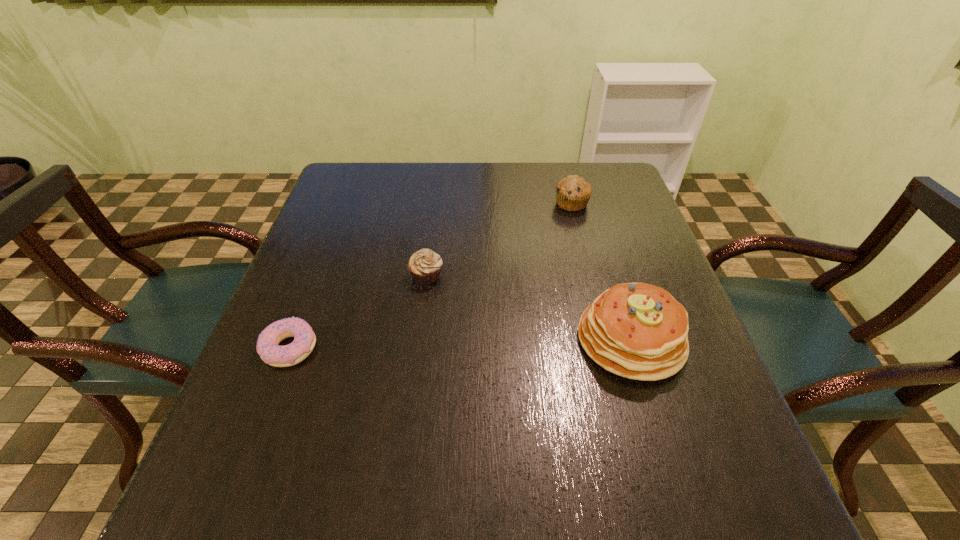
Locate which object is the third closest to the second tallest object. Please provide its 2D coordinates. Your answer should be formatted as a tuple, i.e. [(x, y)], where the tuple contains the x and y coordinates of a point satisfying the conditions above.

[(268, 347)]

This screenshot has height=540, width=960. I want to click on object that is the third closest to the nearer muffin, so click(573, 192).